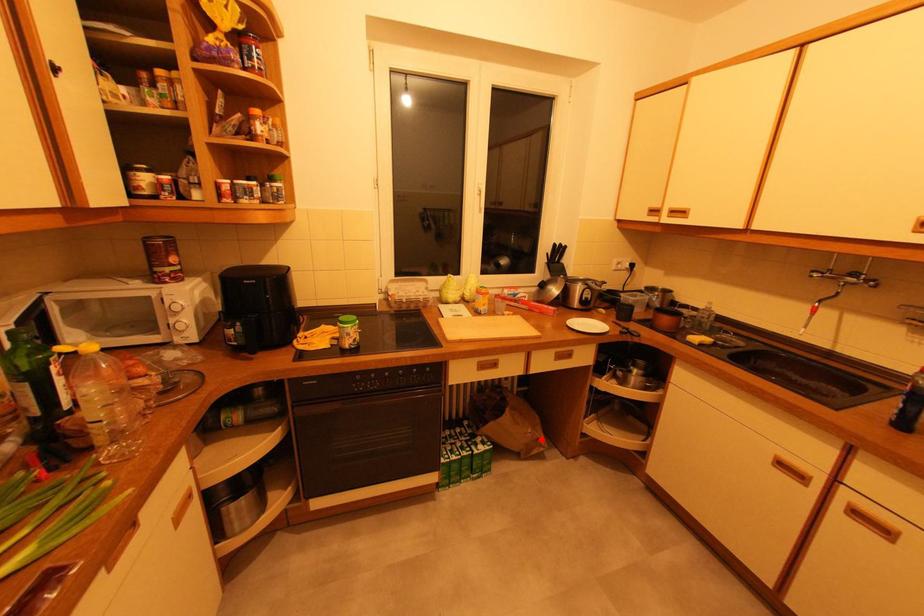
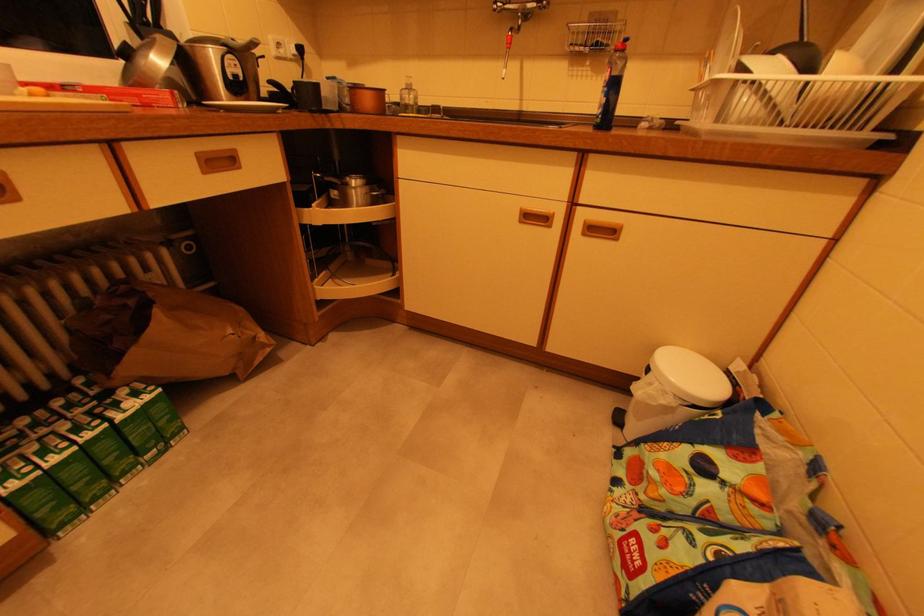
Locate, in the second image, the point that corresponds to the highlighted location in the first image.

(258, 338)